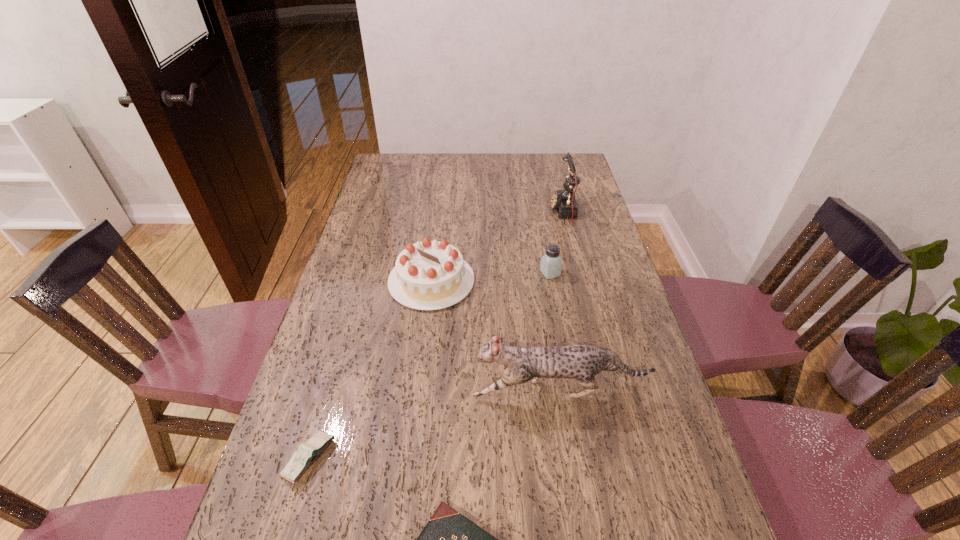
Identify the location of the farthest object. (563, 201).

This screenshot has width=960, height=540. I want to click on the third nearest object, so click(583, 362).

Where is `birthday cake`? The image size is (960, 540). birthday cake is located at coordinates (429, 275).

Where is `saltshaker`? saltshaker is located at coordinates pos(551,263).

Locate an element on the screen. This screenshot has width=960, height=540. the second nearest object is located at coordinates (307, 453).

Identify the location of the leftmost object. The width and height of the screenshot is (960, 540). (307, 453).

Locate an element on the screen. This screenshot has height=540, width=960. free space located on the dial of the telephone is located at coordinates (479, 211).

This screenshot has height=540, width=960. I want to click on vacant space located 0.330m on the dial of the telephone, so click(464, 211).

Locate an element on the screen. The height and width of the screenshot is (540, 960). vacant region located 0.380m on the dial of the telephone is located at coordinates (450, 211).

Where is `free spot located on the face of the cat`? free spot located on the face of the cat is located at coordinates (370, 391).